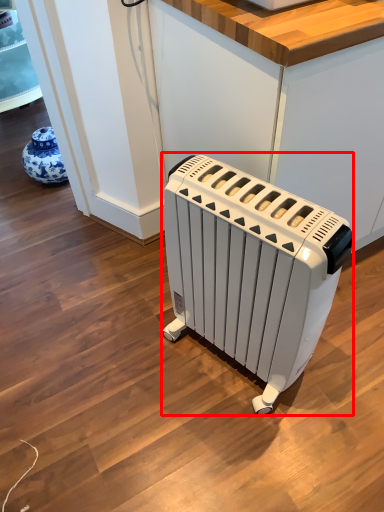
Question: Where is home appliance (annotated by the red box) located in relation to counter in the image?

Choices:
 (A) left
 (B) right

Answer: (A)